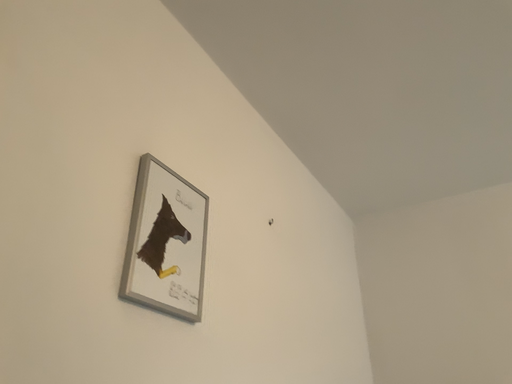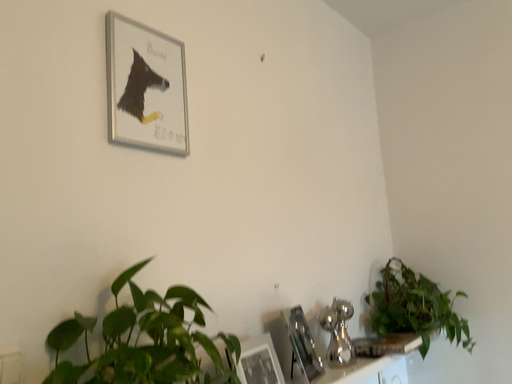
Question: How did the camera likely rotate when shooting the video?

Choices:
 (A) rotated downward
 (B) rotated upward

Answer: (A)